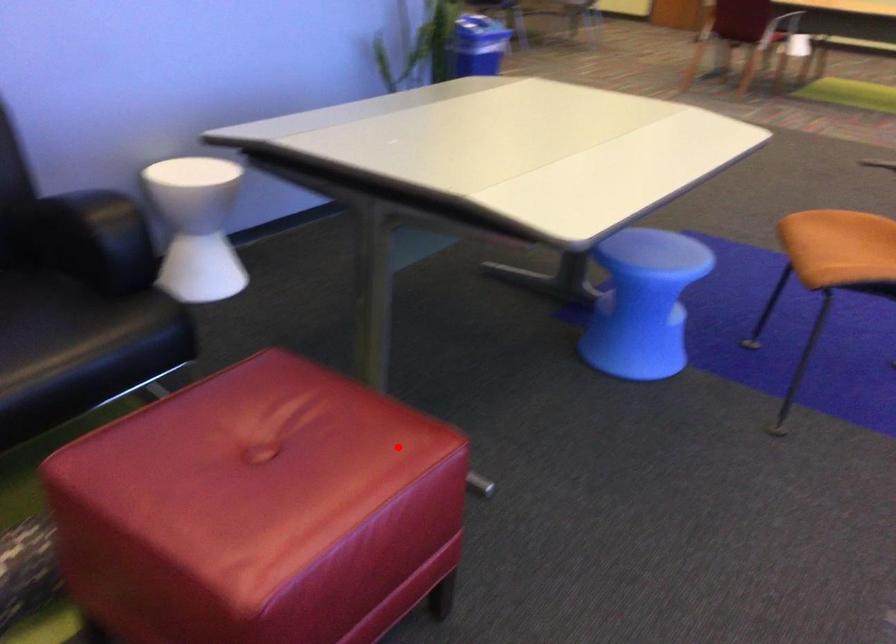
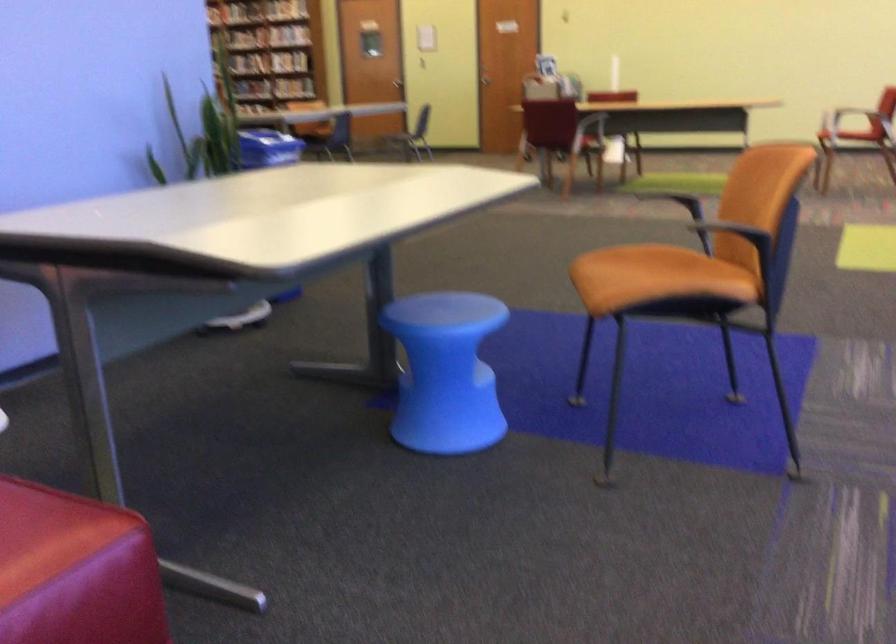
Locate, in the second image, the point that corresponds to the highlighted location in the first image.

(47, 534)